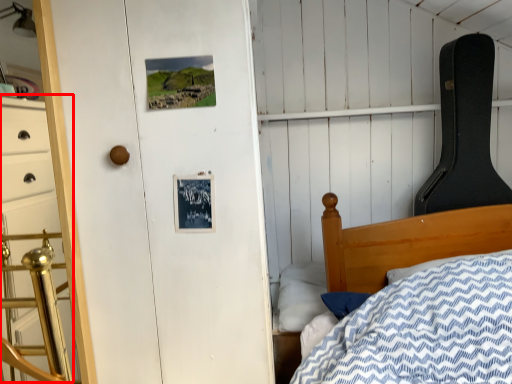
Question: From the image, what is the correct spatial relationship of dresser (annotated by the red box) in relation to pillow?

Choices:
 (A) right
 (B) left

Answer: (B)